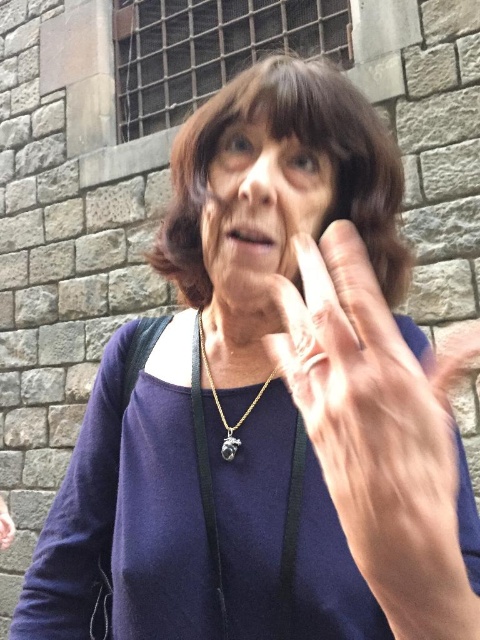
Is pale skin/soft flesh hand at center taller than gold metallic pendant at center?

Indeed, pale skin/soft flesh hand at center has a greater height compared to gold metallic pendant at center.

Looking at this image, between pale skin/soft flesh hand at center and gold metallic pendant at center, which one has more height?

With more height is pale skin/soft flesh hand at center.

Find the location of a particular element. This screenshot has width=480, height=640. pale skin/soft flesh hand at center is located at coordinates (371, 420).

Who is shorter, smooth skin face at center or gold metallic pendant at center?

gold metallic pendant at center is shorter.

Is smooth skin face at center positioned at the back of gold metallic pendant at center?

No, it is in front of gold metallic pendant at center.

Is point (320, 212) positioned after point (238, 428)?

No, it is not.

Where is `smooth skin face at center`? smooth skin face at center is located at coordinates (259, 209).

Is pale skin/soft flesh hand at center below smooth skin face at center?

Indeed, pale skin/soft flesh hand at center is positioned under smooth skin face at center.

Which is more to the right, pale skin/soft flesh hand at center or smooth skin face at center?

Positioned to the right is pale skin/soft flesh hand at center.

This screenshot has height=640, width=480. I want to click on pale skin/soft flesh hand at center, so click(x=371, y=420).